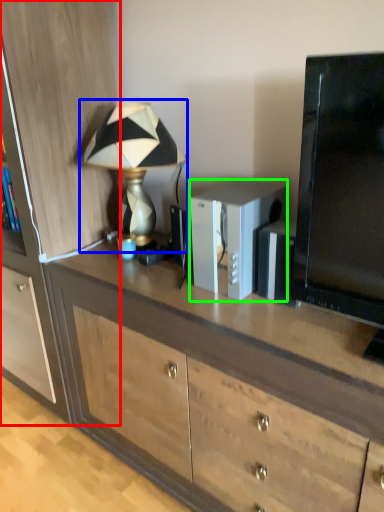
Question: Which object is the farthest from cabinetry (highlighted by a red box)? Choose among these: lamp (highlighted by a blue box) or appliance (highlighted by a green box).

Choices:
 (A) lamp
 (B) appliance

Answer: (B)